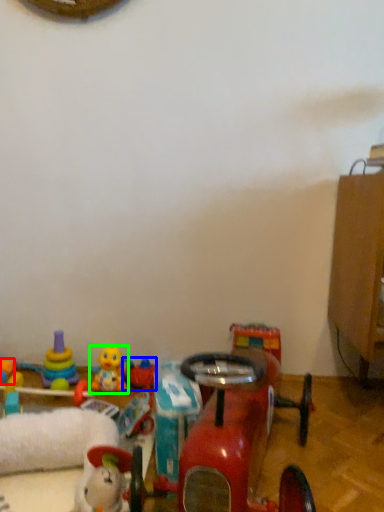
Question: Which object is positioned farthest from toy (highlighted by a red box)? Select from toy (highlighted by a blue box) and toy (highlighted by a green box).

Choices:
 (A) toy
 (B) toy

Answer: (A)